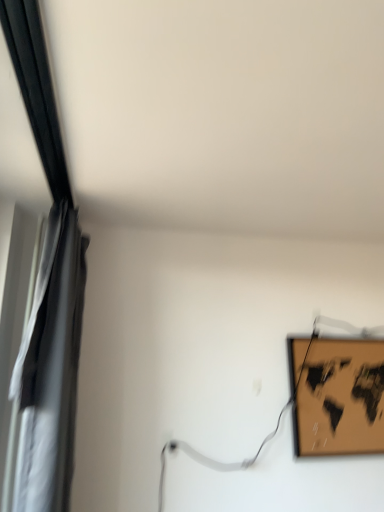
Question: Does wooden map at upper right have a larger size compared to silky black curtain at left?

Choices:
 (A) yes
 (B) no

Answer: (B)

Question: Is wooden map at upper right shorter than silky black curtain at left?

Choices:
 (A) no
 (B) yes

Answer: (B)

Question: Is wooden map at upper right in contact with silky black curtain at left?

Choices:
 (A) yes
 (B) no

Answer: (B)

Question: Is there a large distance between wooden map at upper right and silky black curtain at left?

Choices:
 (A) yes
 (B) no

Answer: (A)

Question: Considering the relative sizes of wooden map at upper right and silky black curtain at left in the image provided, is wooden map at upper right taller than silky black curtain at left?

Choices:
 (A) no
 (B) yes

Answer: (A)

Question: From the image's perspective, does wooden map at upper right appear higher than silky black curtain at left?

Choices:
 (A) no
 (B) yes

Answer: (A)

Question: Does silky black curtain at left appear on the left side of wooden map at upper right?

Choices:
 (A) no
 (B) yes

Answer: (B)

Question: Can you see silky black curtain at left touching wooden map at upper right?

Choices:
 (A) yes
 (B) no

Answer: (B)

Question: Considering the relative sizes of silky black curtain at left and wooden map at upper right in the image provided, is silky black curtain at left taller than wooden map at upper right?

Choices:
 (A) yes
 (B) no

Answer: (A)

Question: Can you confirm if silky black curtain at left is thinner than wooden map at upper right?

Choices:
 (A) no
 (B) yes

Answer: (A)

Question: Considering the relative sizes of silky black curtain at left and wooden map at upper right in the image provided, is silky black curtain at left shorter than wooden map at upper right?

Choices:
 (A) yes
 (B) no

Answer: (B)

Question: Is silky black curtain at left positioned behind wooden map at upper right?

Choices:
 (A) yes
 (B) no

Answer: (B)

Question: Based on their sizes in the image, would you say wooden map at upper right is bigger or smaller than silky black curtain at left?

Choices:
 (A) small
 (B) big

Answer: (A)